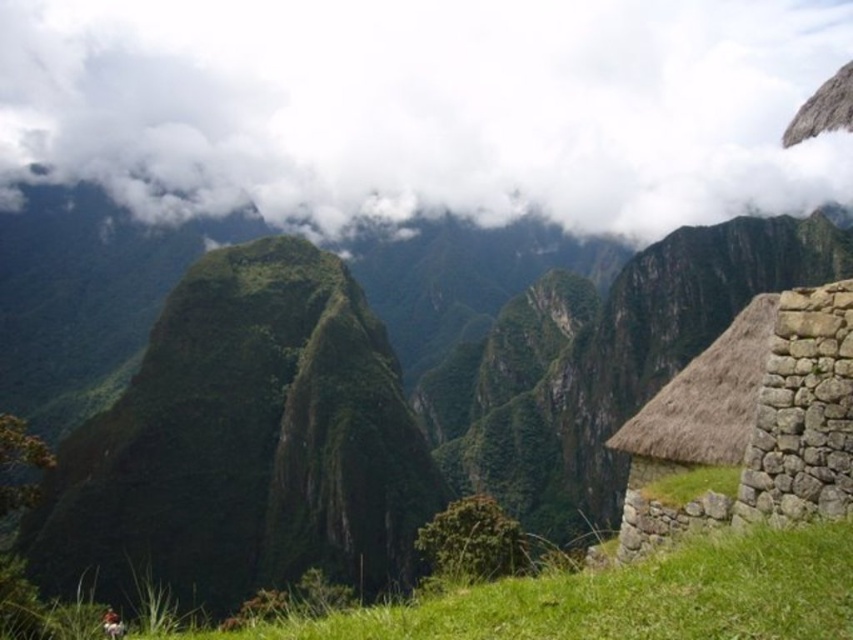
You are a photographer planning to capture the iconic Huayna Picchu mountain in the background along with the brown thatch hut at right. However, there is a white fluffy cloud at upper center that might obstruct the view. Based on their sizes, which object would you need to adjust your camera angle to avoid covering the mountain?

The white fluffy cloud at upper center is larger in size than the brown thatch hut at right, so adjusting the camera angle to avoid the larger cloud would be necessary to ensure the mountain remains visible.

You are a hiker standing at the base of the mountain looking towards the ancient stone structures. You notice two points marked on your map as point 1 at coordinates [656,10] and point 2 at coordinates [759,612]. Which point is closer to you?

Point 1 at coordinates [656,10] is closer to you because it is further to the viewer than point 2 at coordinates [759,612].

You are standing at the point labeled as point (631,596) in the image. What do you see directly in front of you?

You see green grassy at lower center directly in front of you at point (631,596).